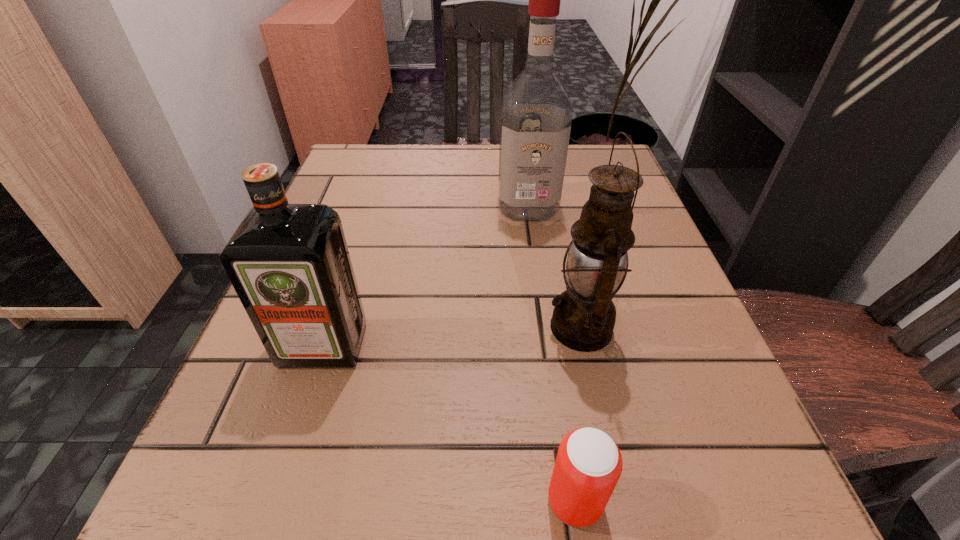
You are a GUI agent. You are given a task and a screenshot of the screen. Output one action in this format:
    pyautogui.click(x=<x>, y=<y>)
    Task: Click on the tallest object
    
    Given the screenshot: What is the action you would take?
    pyautogui.click(x=536, y=115)

The height and width of the screenshot is (540, 960). In order to click on the farthest object in this screenshot , I will do `click(536, 115)`.

Where is `oil lamp`? Image resolution: width=960 pixels, height=540 pixels. oil lamp is located at coordinates (583, 319).

Where is `the nearer liquor`? This screenshot has height=540, width=960. the nearer liquor is located at coordinates (289, 264).

Where is `the leftmost object`? the leftmost object is located at coordinates (289, 264).

Locate an element on the screen. beer can is located at coordinates (588, 465).

The image size is (960, 540). Identify the location of the shortest object. (588, 465).

Image resolution: width=960 pixels, height=540 pixels. Find the location of `vacant region located 0.310m on the front-facing side of the farthest object`. vacant region located 0.310m on the front-facing side of the farthest object is located at coordinates (546, 343).

This screenshot has width=960, height=540. What are the coordinates of `blank space located on the left of the oil lamp` in the screenshot? It's located at (516, 327).

Locate an element on the screen. vacant area situated on the front label of the shorter liquor is located at coordinates (278, 482).